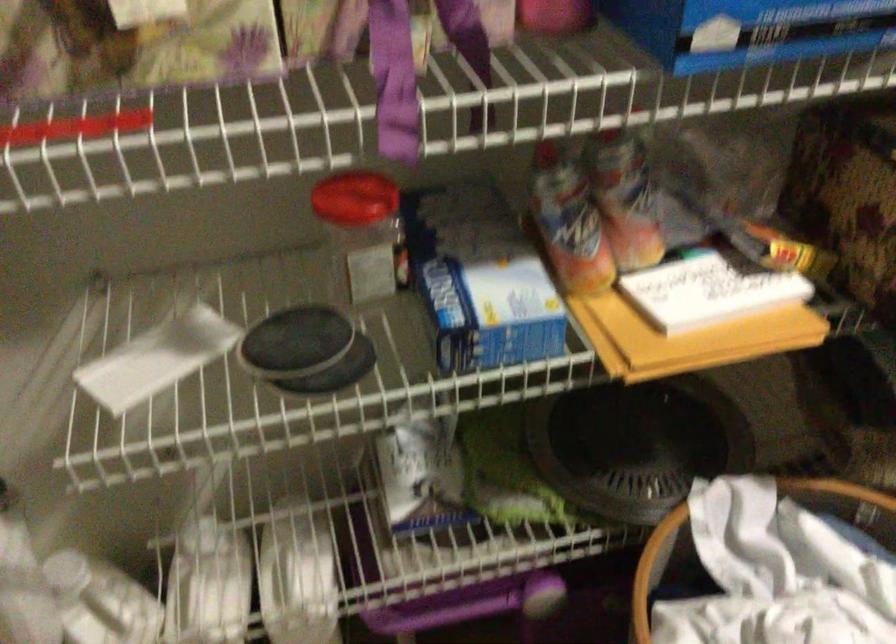
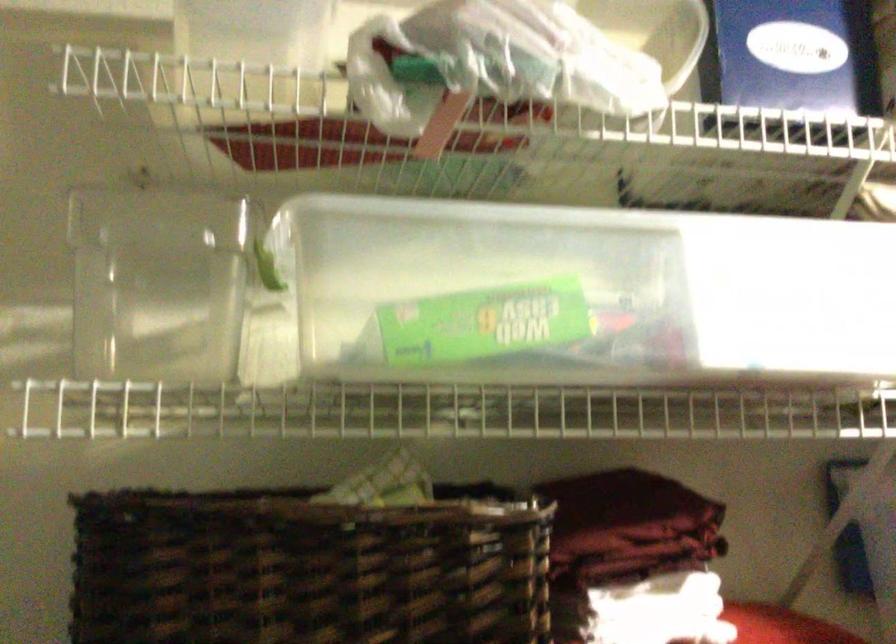
Question: The first image is from the beginning of the video and the second image is from the end. How did the camera likely rotate when shooting the video?

Choices:
 (A) Left
 (B) Right
 (C) Up
 (D) Down

Answer: (C)